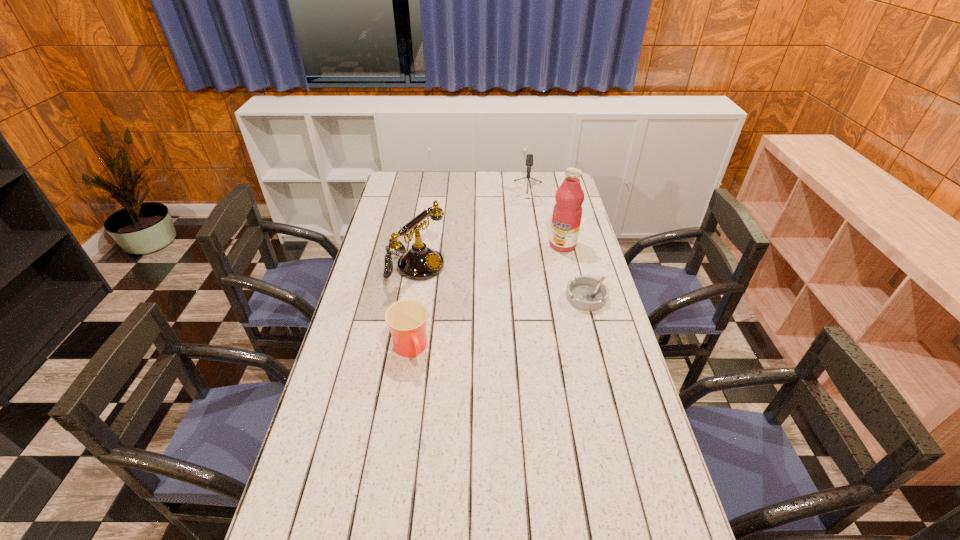
Locate an element on the screen. The height and width of the screenshot is (540, 960). vacant space located on the dial of the telephone is located at coordinates (481, 297).

What are the coordinates of `free region located on the dial of the telephone` in the screenshot? It's located at (516, 312).

Where is `vacant space located 0.400m on the dial of the telephone`? The height and width of the screenshot is (540, 960). vacant space located 0.400m on the dial of the telephone is located at coordinates (538, 320).

This screenshot has width=960, height=540. I want to click on free point located 0.370m on the stand of the microphone, so click(x=521, y=256).

Identify the location of free space located on the stand of the microphone. The width and height of the screenshot is (960, 540). (524, 227).

The height and width of the screenshot is (540, 960). What are the coordinates of `vacant area situated 0.220m on the stand of the microphone` in the screenshot? It's located at (523, 234).

I want to click on object at the far edge, so click(x=529, y=158).

This screenshot has width=960, height=540. I want to click on object that is at the left edge, so click(419, 263).

This screenshot has height=540, width=960. I want to click on ashtray positioned at the right edge, so click(x=586, y=293).

You are a GUI agent. You are given a task and a screenshot of the screen. Output one action in this format:
    pyautogui.click(x=<x>, y=<y>)
    Task: Click on the fruit juice that is at the right edge
    This screenshot has height=540, width=960.
    Given the screenshot: What is the action you would take?
    pyautogui.click(x=567, y=212)